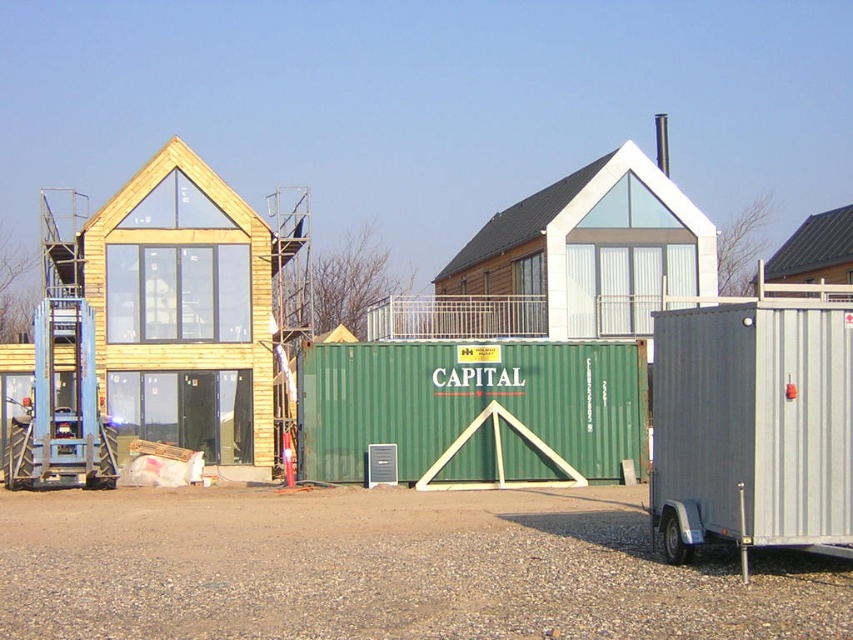
Is white matte wooden hut at center to the right of brown wooden hut at upper right from the viewer's perspective?

No, white matte wooden hut at center is not to the right of brown wooden hut at upper right.

The image size is (853, 640). What do you see at coordinates (590, 250) in the screenshot? I see `white matte wooden hut at center` at bounding box center [590, 250].

Between point (607, 228) and point (785, 244), which one is positioned in front?

Point (607, 228) is in front.

I want to click on white matte wooden hut at center, so click(x=590, y=250).

Does wooden house at left have a smaller size compared to white matte wooden hut at center?

Incorrect, wooden house at left is not smaller in size than white matte wooden hut at center.

Is point (248, 253) closer to viewer compared to point (646, 288)?

Yes, it is in front of point (646, 288).

The width and height of the screenshot is (853, 640). What are the coordinates of `wooden house at left` in the screenshot? It's located at (189, 307).

Is green matte shipping container at center taller than white matte wooden hut at center?

In fact, green matte shipping container at center may be shorter than white matte wooden hut at center.

Is point (544, 348) positioned after point (660, 204)?

No, it is in front of (660, 204).

The image size is (853, 640). I want to click on green matte shipping container at center, so click(x=473, y=410).